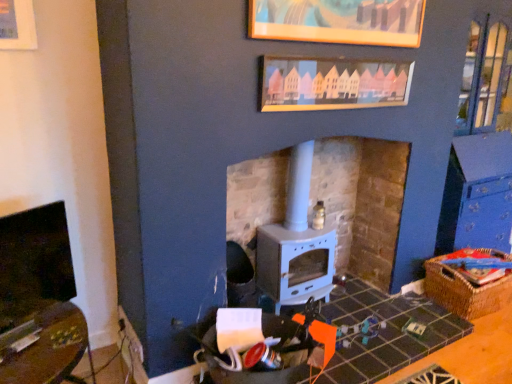
Locate an element on the screen. The height and width of the screenshot is (384, 512). vacant space in front of matte black fireplace at left is located at coordinates (32, 345).